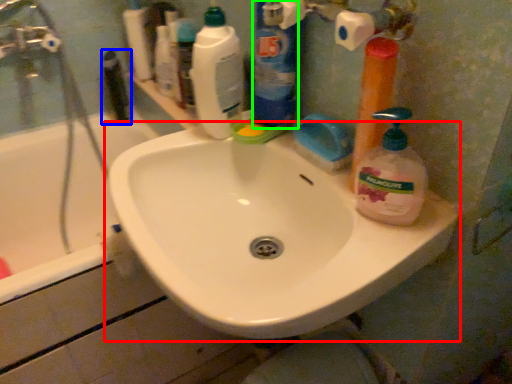
Question: Based on their relative distances, which object is nearer to sink (highlighted by a red box)? Choose from toiletry (highlighted by a blue box) and cleaning product (highlighted by a green box).

Choices:
 (A) toiletry
 (B) cleaning product

Answer: (B)